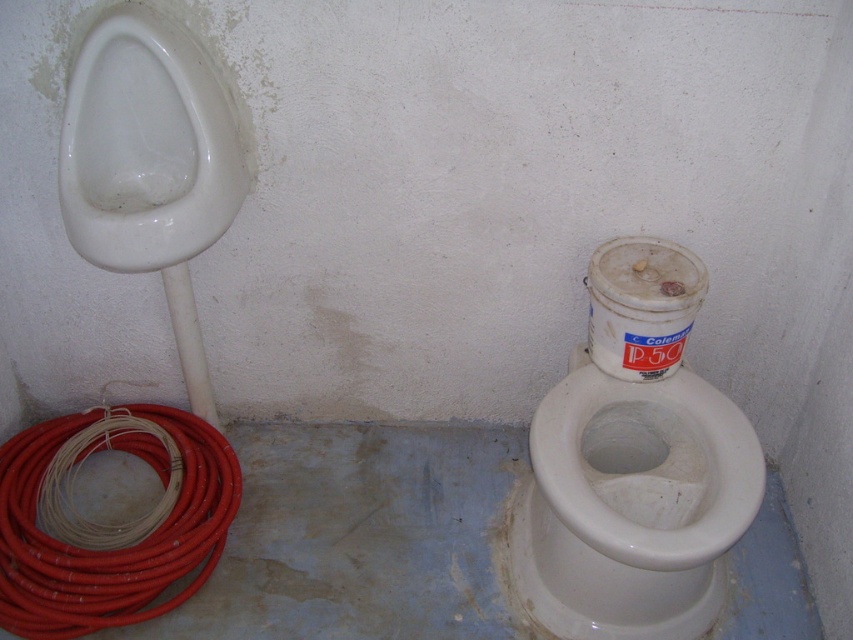
What do you see at coordinates (146, 145) in the screenshot?
I see `white glossy urinal at left` at bounding box center [146, 145].

Is white glossy urinal at left wider than red rubber hose at lower left?

No.

You are a GUI agent. You are given a task and a screenshot of the screen. Output one action in this format:
    pyautogui.click(x=<x>, y=<y>)
    Task: Click on the white glossy urinal at left
    
    Given the screenshot: What is the action you would take?
    pyautogui.click(x=146, y=145)

Where is `white glossy urinal at left`? white glossy urinal at left is located at coordinates (146, 145).

Is point (675, 616) closer to viewer compared to point (94, 163)?

No, (675, 616) is behind (94, 163).

Describe the element at coordinates (631, 504) in the screenshot. The width and height of the screenshot is (853, 640). I see `white glossy toilet bowl at lower right` at that location.

The image size is (853, 640). Identify the location of white glossy toilet bowl at lower right. (631, 504).

The width and height of the screenshot is (853, 640). In order to click on white glossy toilet bowl at lower right in this screenshot , I will do `click(631, 504)`.

Can you confirm if white glossy toilet bowl at lower right is taller than red rubber hose at lower left?

Indeed, white glossy toilet bowl at lower right has a greater height compared to red rubber hose at lower left.

The width and height of the screenshot is (853, 640). I want to click on white glossy toilet bowl at lower right, so click(631, 504).

The width and height of the screenshot is (853, 640). Identify the location of white glossy toilet bowl at lower right. (631, 504).